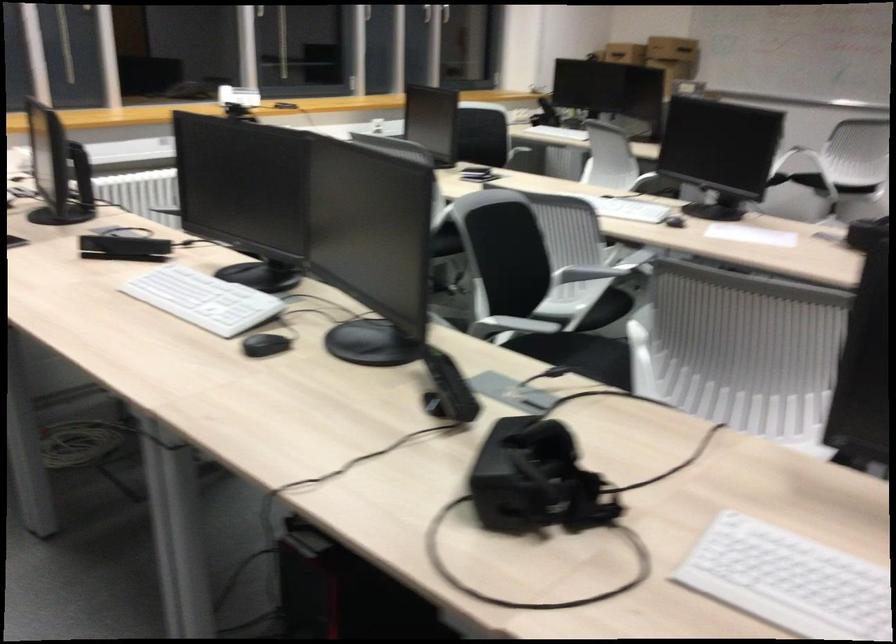
Find where to lift the black sensor bar. Please return your answer as a coordinate pair (x, y).

(124, 247)